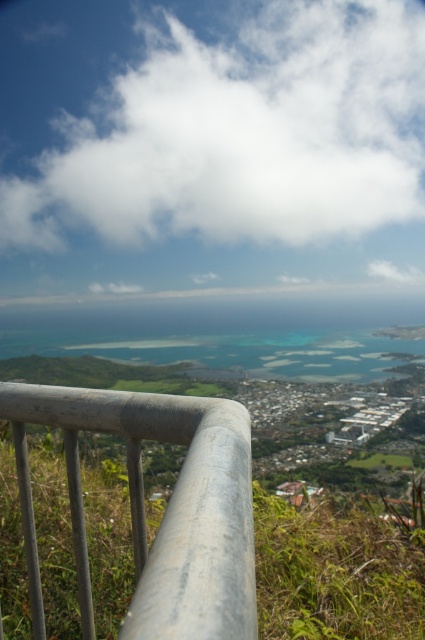
Question: Does white fluffy cloud at upper center lie in front of silver metallic rail at center?

Choices:
 (A) no
 (B) yes

Answer: (A)

Question: Does white fluffy cloud at upper center have a greater width compared to silver metallic rail at center?

Choices:
 (A) no
 (B) yes

Answer: (B)

Question: Which point appears farthest from the camera in this image?

Choices:
 (A) (56, 202)
 (B) (240, 458)

Answer: (A)

Question: Which of the following is the farthest from the observer?

Choices:
 (A) (209, 577)
 (B) (132, 141)

Answer: (B)

Question: Is white fluffy cloud at upper center below silver metallic rail at center?

Choices:
 (A) no
 (B) yes

Answer: (A)